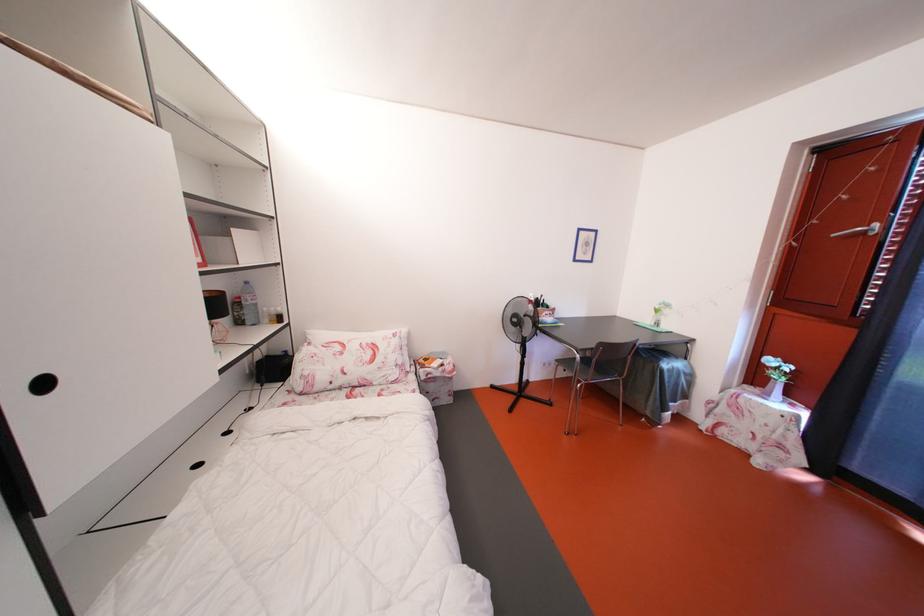
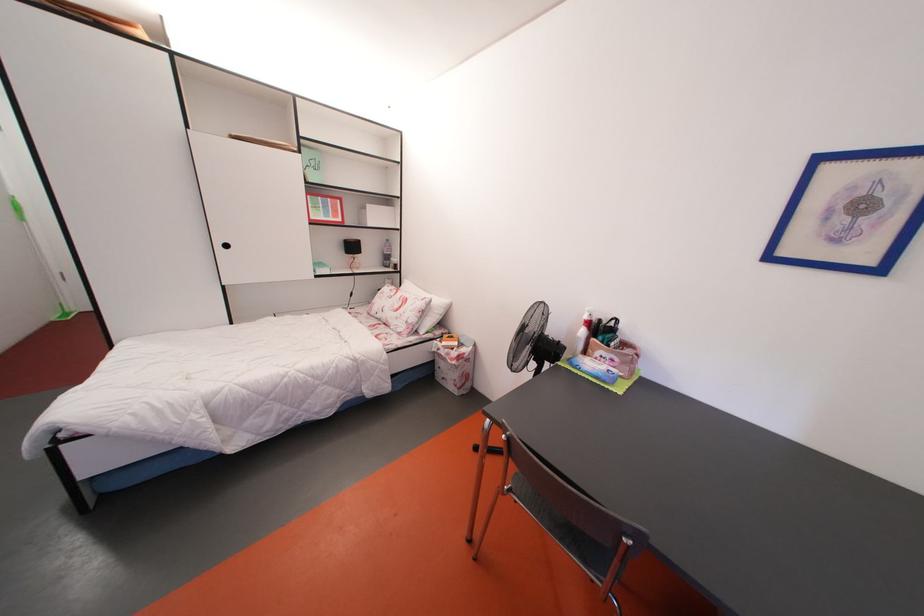
The point at (404, 371) is marked in the first image. Where is the corresponding point in the second image?

(414, 328)